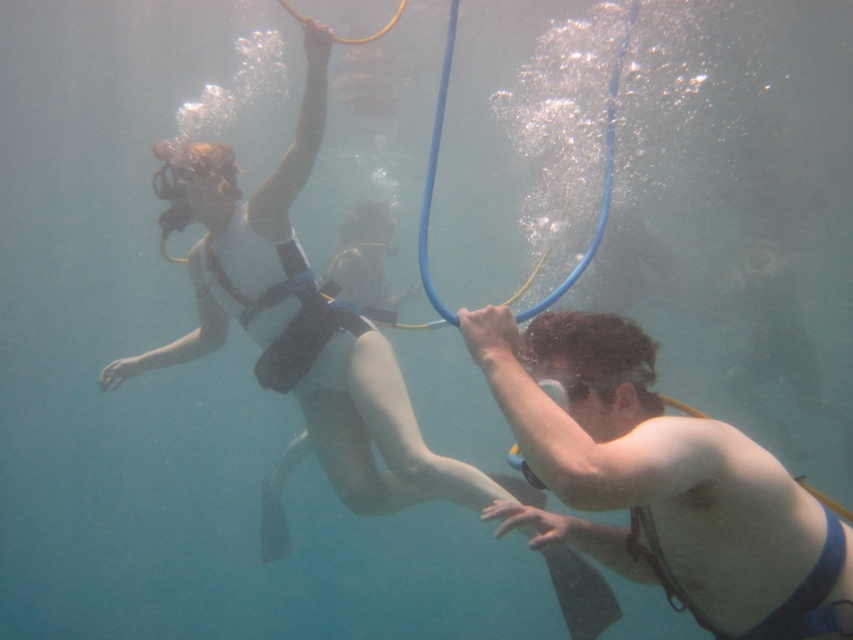
Can you confirm if smooth skin diver at center is smaller than matte black wetsuit at center?

Yes.

Between smooth skin diver at center and matte black wetsuit at center, which one has more height?

Standing taller between the two is matte black wetsuit at center.

You are a GUI agent. You are given a task and a screenshot of the screen. Output one action in this format:
    pyautogui.click(x=<x>, y=<y>)
    Task: Click on the smooth skin diver at center
    The image size is (853, 640).
    Given the screenshot: What is the action you would take?
    pyautogui.click(x=660, y=481)

The width and height of the screenshot is (853, 640). I want to click on smooth skin diver at center, so click(660, 481).